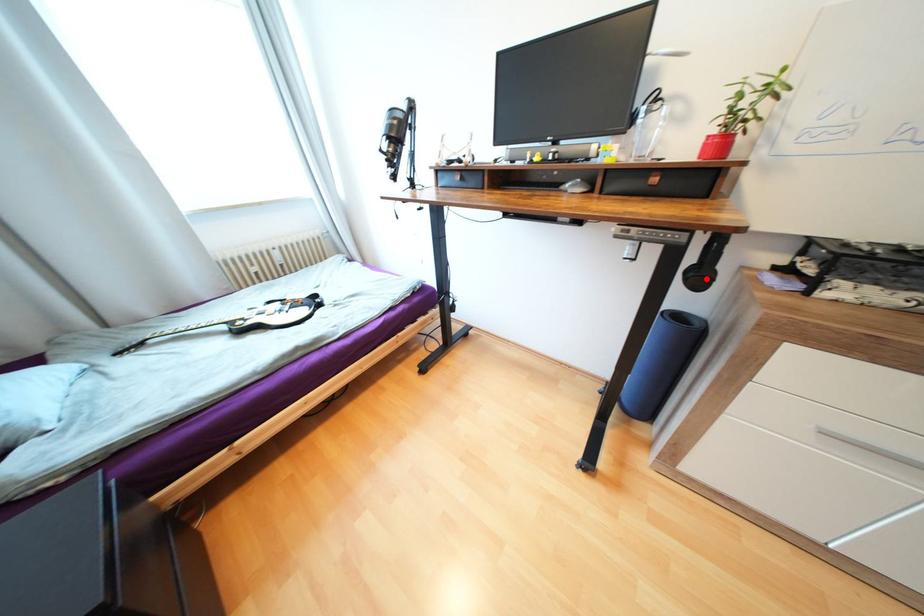
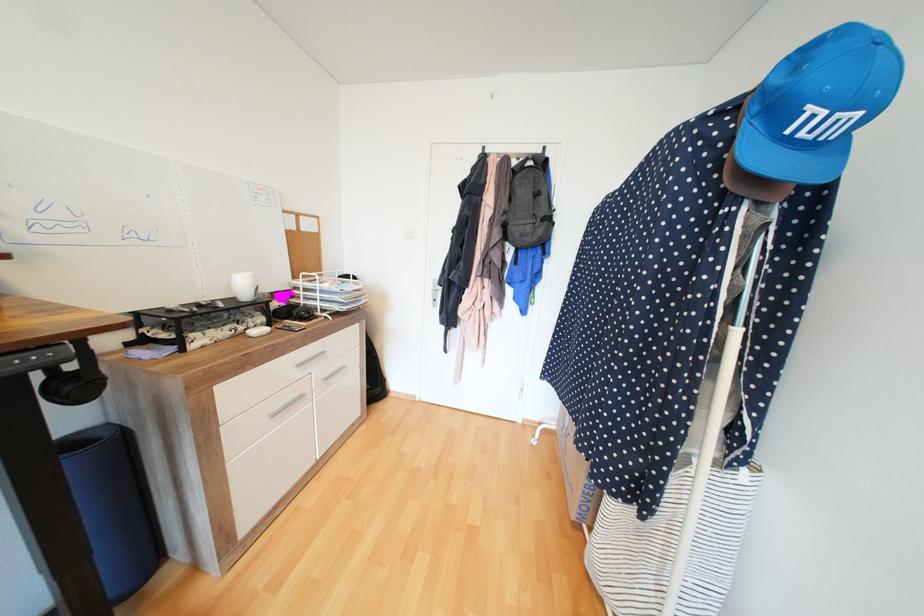
The point at the highlighted location is marked in the first image. Where is the corresponding point in the second image?

(88, 387)